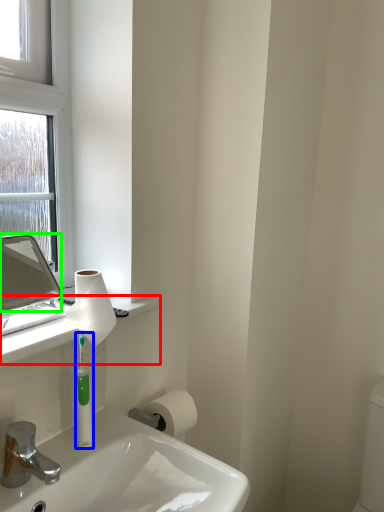
Question: Which object is positioned farthest from counter top (highlighted by a red box)? Select from mouthwash (highlighted by a blue box) and mirror (highlighted by a green box).

Choices:
 (A) mouthwash
 (B) mirror

Answer: (B)